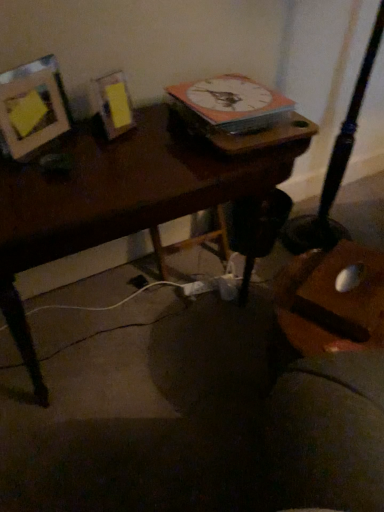
In order to face matte wood picture frame at upper left, should I rotate leftwards or rightwards?

Rotate your view left by about 20.365°.

Where is `wooden desk at center`? wooden desk at center is located at coordinates (117, 200).

Which object is positioned more to the right, white glossy clock at upper center or wooden desk at center?

white glossy clock at upper center.

From the image's perspective, who appears lower, white glossy clock at upper center or wooden desk at center?

From the image's view, wooden desk at center is below.

Do you think white glossy clock at upper center is within wooden desk at center, or outside of it?

white glossy clock at upper center exists outside the volume of wooden desk at center.

Looking at this image, does white glossy clock at upper center have a greater width compared to wooden desk at center?

No.

Based on the photo, which object is more forward, wooden desk at center or matte wood picture frame at upper left?

wooden desk at center.

Between wooden desk at center and matte wood picture frame at upper left, which one has larger width?

With larger width is wooden desk at center.

What's the angular difference between wooden desk at center and matte wood picture frame at upper left's facing directions?

There is a 29.5-degree angle between the facing directions of wooden desk at center and matte wood picture frame at upper left.

Measure the distance from matte wood picture frame at upper left to white glossy clock at upper center.

matte wood picture frame at upper left and white glossy clock at upper center are 51.57 centimeters apart.

Can you confirm if matte wood picture frame at upper left is shorter than white glossy clock at upper center?

Incorrect, the height of matte wood picture frame at upper left does not fall short of that of white glossy clock at upper center.

Considering the sizes of matte wood picture frame at upper left and white glossy clock at upper center in the image, is matte wood picture frame at upper left bigger or smaller than white glossy clock at upper center?

matte wood picture frame at upper left is smaller than white glossy clock at upper center.

Can you see matte wood picture frame at upper left touching white glossy clock at upper center?

matte wood picture frame at upper left is not next to white glossy clock at upper center, and they're not touching.

Considering the sizes of white glossy clock at upper center and matte wood picture frame at upper left in the image, is white glossy clock at upper center taller or shorter than matte wood picture frame at upper left?

Considering their sizes, white glossy clock at upper center has less height than matte wood picture frame at upper left.

Based on the photo, how far apart are white glossy clock at upper center and matte wood picture frame at upper left?

white glossy clock at upper center and matte wood picture frame at upper left are 20.30 inches apart from each other.

From the image's perspective, which is above, white glossy clock at upper center or matte wood picture frame at upper left?

white glossy clock at upper center appears higher in the image.

From a real-world perspective, relative to matte wood picture frame at upper left, is white glossy clock at upper center vertically above or below?

Clearly, from a real-world perspective, white glossy clock at upper center is below matte wood picture frame at upper left.

Which of these two, wooden desk at center or white glossy clock at upper center, is thinner?

With smaller width is white glossy clock at upper center.

Between wooden desk at center and white glossy clock at upper center, which one appears on the left side from the viewer's perspective?

wooden desk at center is more to the left.

The image size is (384, 512). Identify the location of desk below the white glossy clock at upper center (from the image's perspective). (117, 200).

From the picture: From the image's perspective, between wooden desk at center and white glossy clock at upper center, which one is located above?

white glossy clock at upper center appears higher in the image.

Between matte wood picture frame at upper left and wooden desk at center, which one has larger width?

Wider between the two is wooden desk at center.

Can you confirm if matte wood picture frame at upper left is positioned to the right of wooden desk at center?

No, matte wood picture frame at upper left is not to the right of wooden desk at center.

Locate an element on the screen. desk beneath the matte wood picture frame at upper left (from a real-world perspective) is located at coordinates 117,200.

From the image's perspective, does matte wood picture frame at upper left appear lower than wooden desk at center?

Actually, matte wood picture frame at upper left appears above wooden desk at center in the image.

The height and width of the screenshot is (512, 384). In order to click on desk located in front of the white glossy clock at upper center in this screenshot , I will do `click(117, 200)`.

Locate an element on the screen. This screenshot has width=384, height=512. picture frame on the left of wooden desk at center is located at coordinates (32, 108).

Considering their positions, is matte wood picture frame at upper left positioned closer to white glossy clock at upper center than wooden desk at center?

Among the two, wooden desk at center is located nearer to white glossy clock at upper center.

In the scene shown: Considering their positions, is white glossy clock at upper center positioned closer to matte wood picture frame at upper left than wooden desk at center?

Among the two, wooden desk at center is located nearer to matte wood picture frame at upper left.

Looking at the image, which one is located closer to wooden desk at center, white glossy clock at upper center or matte wood picture frame at upper left?

The object closer to wooden desk at center is matte wood picture frame at upper left.

Estimate the real-world distances between objects in this image. Which object is closer to matte wood picture frame at upper left, wooden desk at center or white glossy clock at upper center?

Based on the image, wooden desk at center appears to be nearer to matte wood picture frame at upper left.

Considering their positions, is wooden desk at center positioned further to white glossy clock at upper center than matte wood picture frame at upper left?

matte wood picture frame at upper left lies further to white glossy clock at upper center than the other object.

Estimate the real-world distances between objects in this image. Which object is closer to wooden desk at center, matte wood picture frame at upper left or white glossy clock at upper center?

matte wood picture frame at upper left is closer to wooden desk at center.

In order to click on desk located between matte wood picture frame at upper left and white glossy clock at upper center in the left-right direction in this screenshot , I will do `click(117, 200)`.